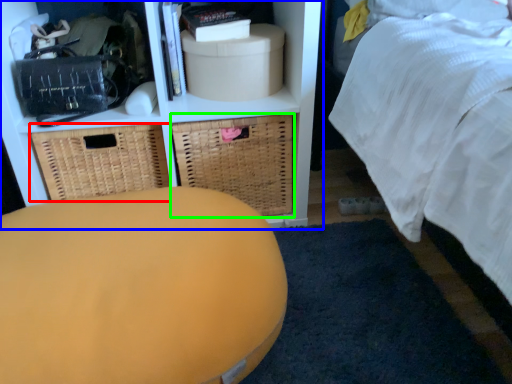
Question: Which object is the farthest from basket (highlighted by a red box)? Choose among these: shelf (highlighted by a blue box) or basket (highlighted by a green box).

Choices:
 (A) shelf
 (B) basket

Answer: (B)